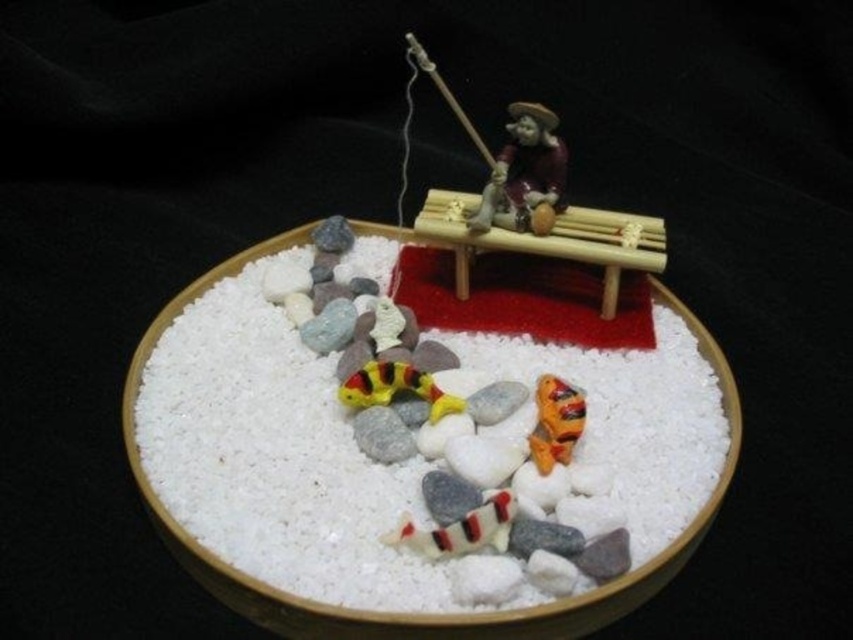
Can you confirm if matte brown figurine at center is positioned above striped rubber snake at center?

Indeed, matte brown figurine at center is positioned over striped rubber snake at center.

Is point (550, 152) positioned behind point (431, 531)?

Yes, point (550, 152) is farther from viewer.

This screenshot has width=853, height=640. What are the coordinates of `matte brown figurine at center` in the screenshot? It's located at (524, 172).

Can you confirm if striped rubber snake at center is taller than orange rubber fish at lower center?

Incorrect, striped rubber snake at center's height is not larger of orange rubber fish at lower center's.

Is point (415, 550) less distant than point (572, 442)?

That is True.

I want to click on striped rubber snake at center, so click(460, 529).

Is matte brown wooden boat at upper center shorter than orange rubber fish at lower center?

In fact, matte brown wooden boat at upper center may be taller than orange rubber fish at lower center.

Between point (463, 237) and point (560, 449), which one is positioned in front?

Point (560, 449)

Locate an element on the screen. matte brown wooden boat at upper center is located at coordinates (549, 237).